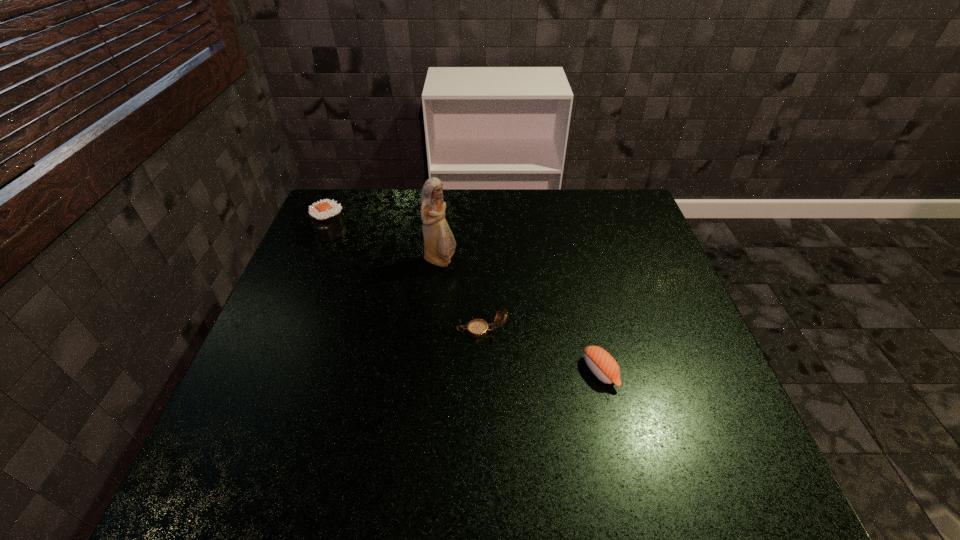
Find the location of `vacant space situated 0.360m on the face of the compass`. vacant space situated 0.360m on the face of the compass is located at coordinates (307, 330).

Image resolution: width=960 pixels, height=540 pixels. Identify the location of vacant region located on the face of the compass. (398, 330).

Where is `free space located on the face of the compass`? The image size is (960, 540). free space located on the face of the compass is located at coordinates (398, 330).

Image resolution: width=960 pixels, height=540 pixels. I want to click on free space located on the back of the shorter sushi, so click(x=569, y=244).

Locate an element on the screen. This screenshot has width=960, height=540. object that is at the far edge is located at coordinates (326, 217).

I want to click on object situated at the left edge, so click(326, 217).

Find the location of a particular element. The width and height of the screenshot is (960, 540). object located at the far left corner is located at coordinates (326, 217).

Identify the location of vacant region at the far edge of the desktop. (378, 204).

This screenshot has width=960, height=540. In order to click on free space at the near edge in this screenshot , I will do `click(374, 491)`.

Find the location of a particular element. This screenshot has height=540, width=960. vacant position at the left edge of the desktop is located at coordinates (324, 276).